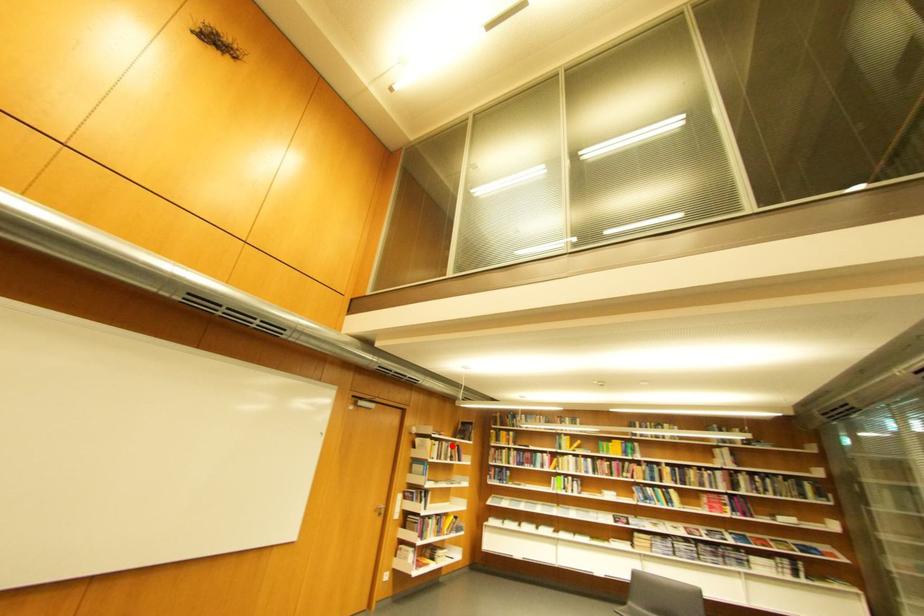
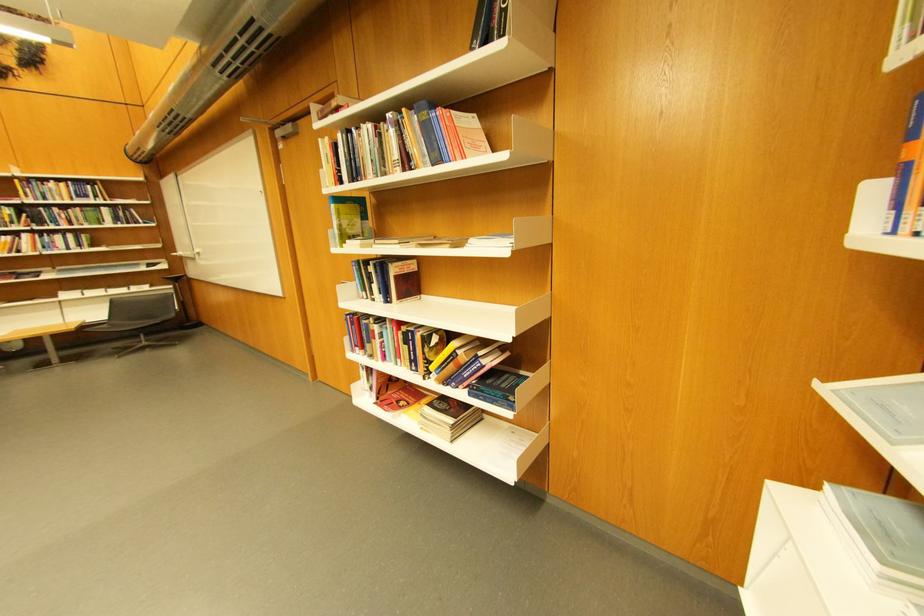
Question: I am providing you with two images of the same scene from different viewpoints. In image1, a red point is highlighted. Considering the same 3D point in image2, which of the following is correct?

Choices:
 (A) It is closer
 (B) It is farther

Answer: (A)